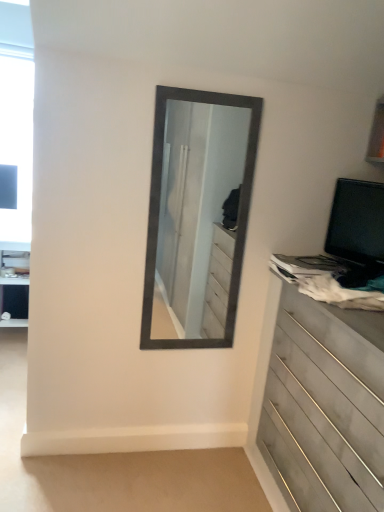
This screenshot has height=512, width=384. Describe the element at coordinates (357, 222) in the screenshot. I see `black glossy computer monitor at right` at that location.

What is the approximate height of black glossy computer monitor at right?

black glossy computer monitor at right is 14.92 inches tall.

Where is `black glossy computer monitor at right`? This screenshot has width=384, height=512. black glossy computer monitor at right is located at coordinates (357, 222).

Describe the element at coordinates (324, 409) in the screenshot. I see `wooden chest of drawers at right` at that location.

You are a GUI agent. You are given a task and a screenshot of the screen. Output one action in this format:
    pyautogui.click(x=<x>, y=<y>)
    Task: Click on the wooden chest of drawers at right
    
    Given the screenshot: What is the action you would take?
    pyautogui.click(x=324, y=409)

Where is `black glossy computer monitor at right`? This screenshot has height=512, width=384. black glossy computer monitor at right is located at coordinates (357, 222).

Considering the relative positions of wooden chest of drawers at right and black glossy computer monitor at right in the image provided, is wooden chest of drawers at right to the right of black glossy computer monitor at right from the viewer's perspective?

No.

Based on the photo, considering the positions of objects wooden chest of drawers at right and black glossy computer monitor at right in the image provided, who is in front, wooden chest of drawers at right or black glossy computer monitor at right?

wooden chest of drawers at right is more forward.

Between point (292, 361) and point (339, 229), which one is positioned behind?

The point (339, 229) is behind.

From the image's perspective, is wooden chest of drawers at right under black glossy computer monitor at right?

Yes, from the image's perspective, wooden chest of drawers at right is below black glossy computer monitor at right.

From a real-world perspective, which object stands above the other?

black glossy computer monitor at right.

Can you confirm if wooden chest of drawers at right is thinner than black glossy computer monitor at right?

No.

Between wooden chest of drawers at right and black glossy computer monitor at right, which one has less height?

With less height is black glossy computer monitor at right.

Is wooden chest of drawers at right bigger or smaller than black glossy computer monitor at right?

Considering their sizes, wooden chest of drawers at right takes up more space than black glossy computer monitor at right.

Is wooden chest of drawers at right surrounding black glossy computer monitor at right?

No, black glossy computer monitor at right is located outside of wooden chest of drawers at right.

Consider the image. Is there a large distance between wooden chest of drawers at right and black glossy computer monitor at right?

No, wooden chest of drawers at right is not far from black glossy computer monitor at right.

From the picture: Is wooden chest of drawers at right looking in the opposite direction of black glossy computer monitor at right?

No, wooden chest of drawers at right is not facing the opposite direction of black glossy computer monitor at right.

Measure the distance from wooden chest of drawers at right to black glossy computer monitor at right.

The distance of wooden chest of drawers at right from black glossy computer monitor at right is 22.43 inches.

Locate an element on the screen. This screenshot has height=512, width=384. computer monitor that is above the wooden chest of drawers at right (from a real-world perspective) is located at coordinates (357, 222).

Is black glossy computer monitor at right at the right side of wooden chest of drawers at right?

Yes.

Does black glossy computer monitor at right come in front of wooden chest of drawers at right?

No, it is not.

Is point (327, 237) farther from viewer compared to point (313, 361)?

Yes, point (327, 237) is farther from viewer.

From the image's perspective, is black glossy computer monitor at right positioned above or below wooden chest of drawers at right?

Clearly, from the image's perspective, black glossy computer monitor at right is above wooden chest of drawers at right.

From a real-world perspective, which is physically below, black glossy computer monitor at right or wooden chest of drawers at right?

wooden chest of drawers at right.

Considering the sizes of objects black glossy computer monitor at right and wooden chest of drawers at right in the image provided, who is wider, black glossy computer monitor at right or wooden chest of drawers at right?

With larger width is wooden chest of drawers at right.

In the scene shown: Is black glossy computer monitor at right taller or shorter than wooden chest of drawers at right?

Clearly, black glossy computer monitor at right is shorter compared to wooden chest of drawers at right.

In the scene shown: Is black glossy computer monitor at right bigger than wooden chest of drawers at right?

No, black glossy computer monitor at right is not bigger than wooden chest of drawers at right.

Do you think black glossy computer monitor at right is within wooden chest of drawers at right, or outside of it?

black glossy computer monitor at right exists outside the volume of wooden chest of drawers at right.

Consider the image. Are black glossy computer monitor at right and wooden chest of drawers at right located far from each other?

No, black glossy computer monitor at right is not far away from wooden chest of drawers at right.

Does black glossy computer monitor at right turn towards wooden chest of drawers at right?

No, black glossy computer monitor at right is not facing towards wooden chest of drawers at right.

What's the angular difference between black glossy computer monitor at right and wooden chest of drawers at right's facing directions?

30.5 degrees separate the facing orientations of black glossy computer monitor at right and wooden chest of drawers at right.

At what (x,y) coordinates should I click in order to perform the action: click on computer monitor on the right of wooden chest of drawers at right. Please return your answer as a coordinate pair (x, y). The width and height of the screenshot is (384, 512). Looking at the image, I should click on (357, 222).

Locate an element on the screen. This screenshot has width=384, height=512. computer monitor above the wooden chest of drawers at right (from a real-world perspective) is located at coordinates click(x=357, y=222).

Identify the location of computer monitor above the wooden chest of drawers at right (from the image's perspective). (357, 222).